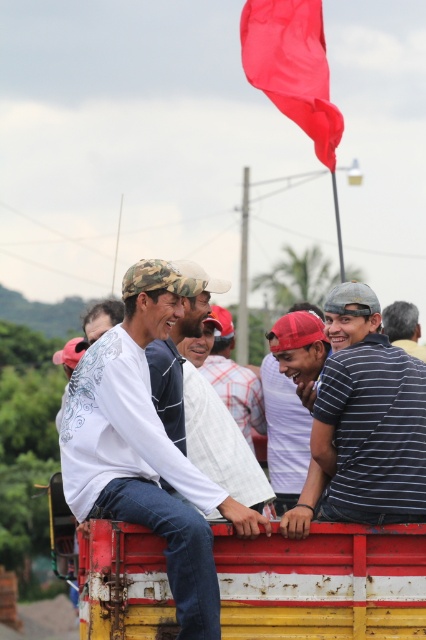
Question: Does white cotton shirt at center lie behind gray striped shirt at upper right?

Choices:
 (A) no
 (B) yes

Answer: (B)

Question: Is smooth fabric flag at upper center to the right of gray striped shirt at upper right from the viewer's perspective?

Choices:
 (A) no
 (B) yes

Answer: (A)

Question: From the image, what is the correct spatial relationship of rustic metal truck bed at center in relation to smooth fabric flag at upper center?

Choices:
 (A) above
 (B) below

Answer: (B)

Question: Which of the following is the closest to the observer?

Choices:
 (A) striped cotton shirt at center
 (B) rustic metal truck bed at center
 (C) gray striped shirt at upper right

Answer: (A)

Question: Among these points, which one is farthest from the camera?

Choices:
 (A) (232, 364)
 (B) (336, 456)
 (C) (319, 48)

Answer: (C)

Question: Which of the following is the closest to the observer?

Choices:
 (A) (203, 372)
 (B) (388, 316)
 (C) (160, 474)

Answer: (C)